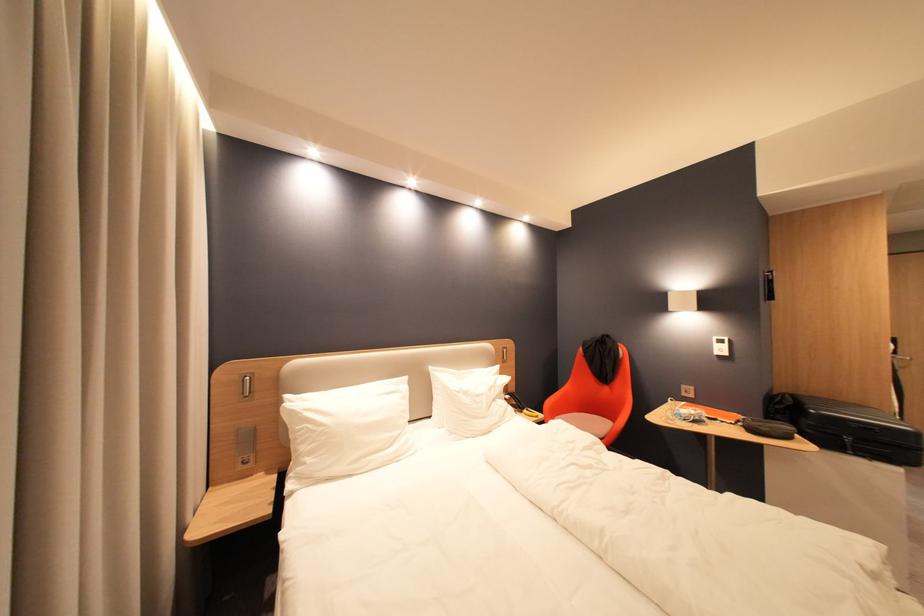
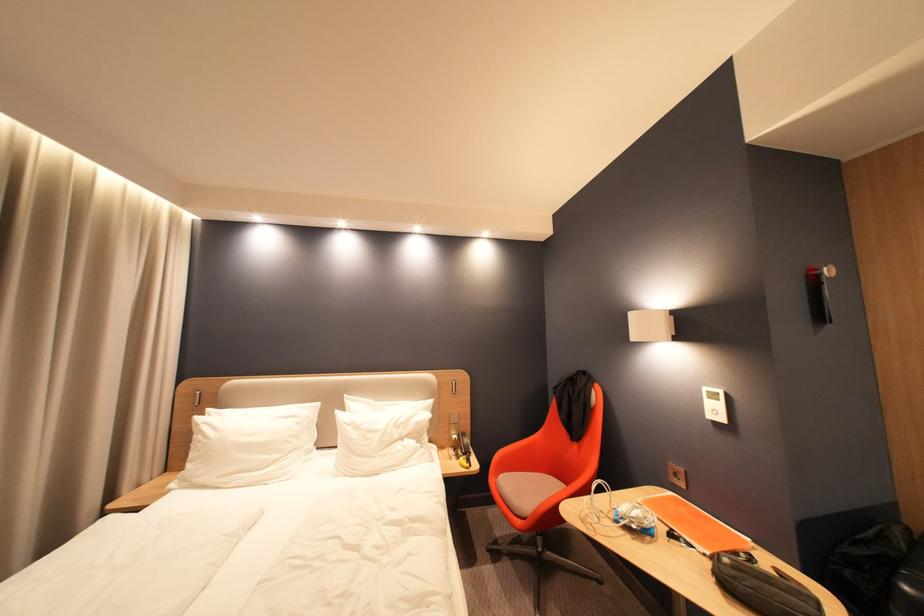
In the second image, find the point that corresponds to [508,367] in the first image.

(443, 400)